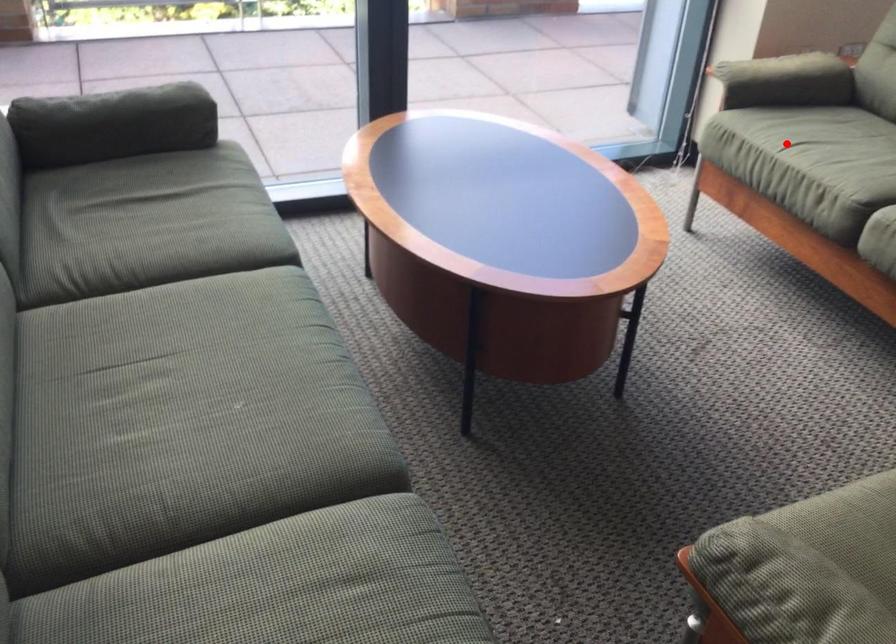
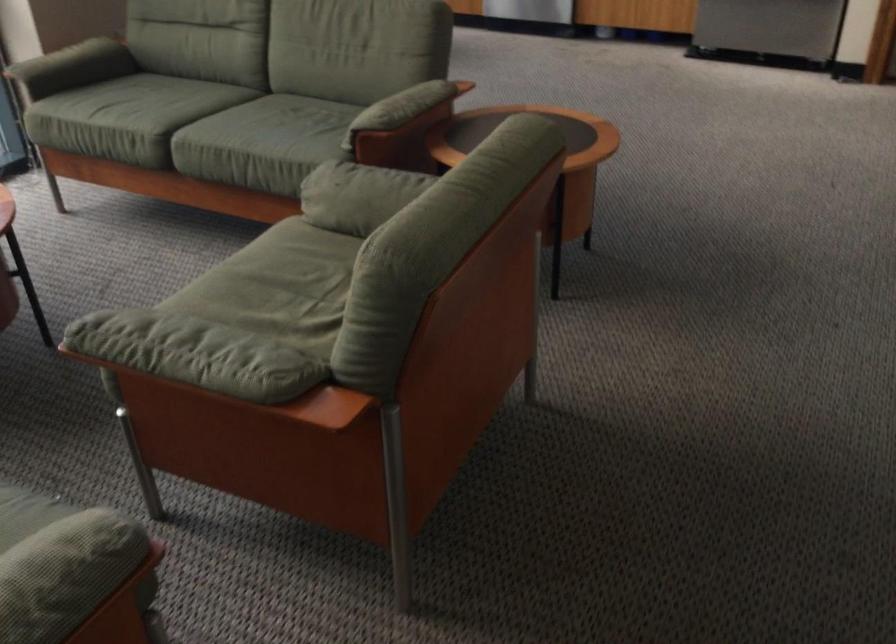
In the second image, find the point that corresponds to the highlighted location in the first image.

(97, 108)